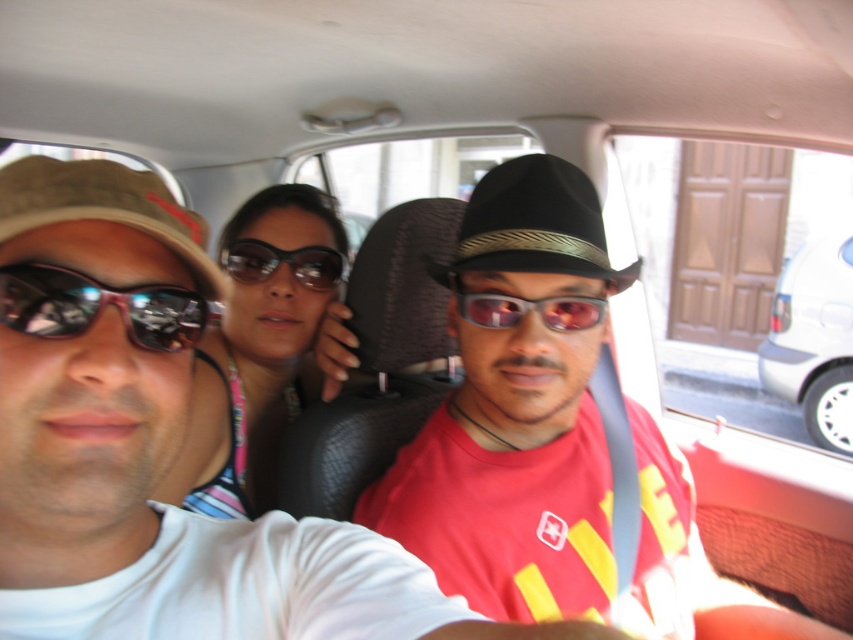
You are a passenger in the taxi and need to place a small item exactly at the coordinates mentioned in the scene description. Where should you place it relative to the matte black sunglasses at left?

The coordinates provided in the scene description for the matte black sunglasses at left are at point (97, 307). You should place the item at that exact location relative to the sunglasses.

You are a passenger in a vehicle and want to place your 3.5 inch wide book between the matte black sunglasses at center and the shiny black sunglasses at center. Can the book fit between them?

The distance between the matte black sunglasses at center and the shiny black sunglasses at center is 6.60 inches. Since the book is 3.5 inches wide, it can fit between them as there is enough space.

You are a passenger in the vehicle and need to place both the brown fabric cowboy hat at left and the reflective plastic goggles at center into a small bag. Which item should you place first to ensure they both fit?

The brown fabric cowboy hat at left is wider than the reflective plastic goggles at center, so you should place the reflective plastic goggles at center first to make space for the wider hat.